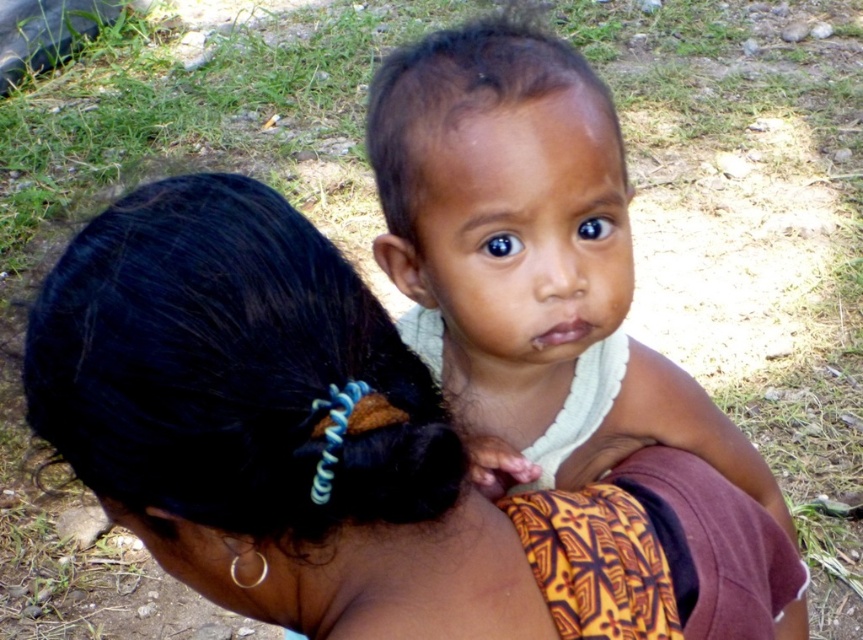
Question: Which point is closer to the camera taking this photo?

Choices:
 (A) (328, 289)
 (B) (558, 236)

Answer: (A)

Question: In this image, where is black hair at upper left located relative to smooth skin baby at center?

Choices:
 (A) above
 (B) below

Answer: (B)

Question: Does black hair at upper left have a smaller size compared to smooth skin baby at center?

Choices:
 (A) yes
 (B) no

Answer: (A)

Question: Is black hair at upper left bigger than smooth skin baby at center?

Choices:
 (A) no
 (B) yes

Answer: (A)

Question: Which object appears closest to the camera in this image?

Choices:
 (A) smooth skin baby at center
 (B) black hair at upper left

Answer: (B)